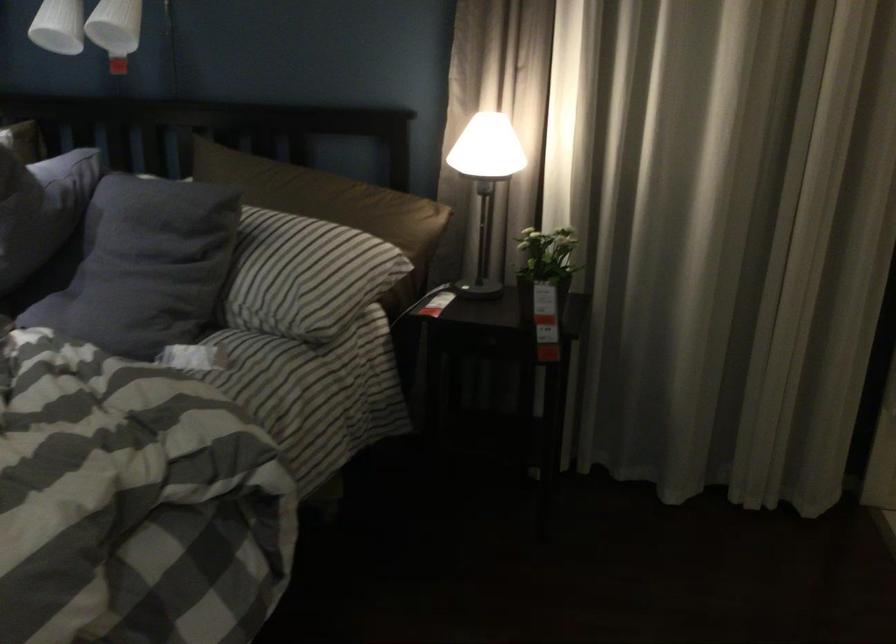
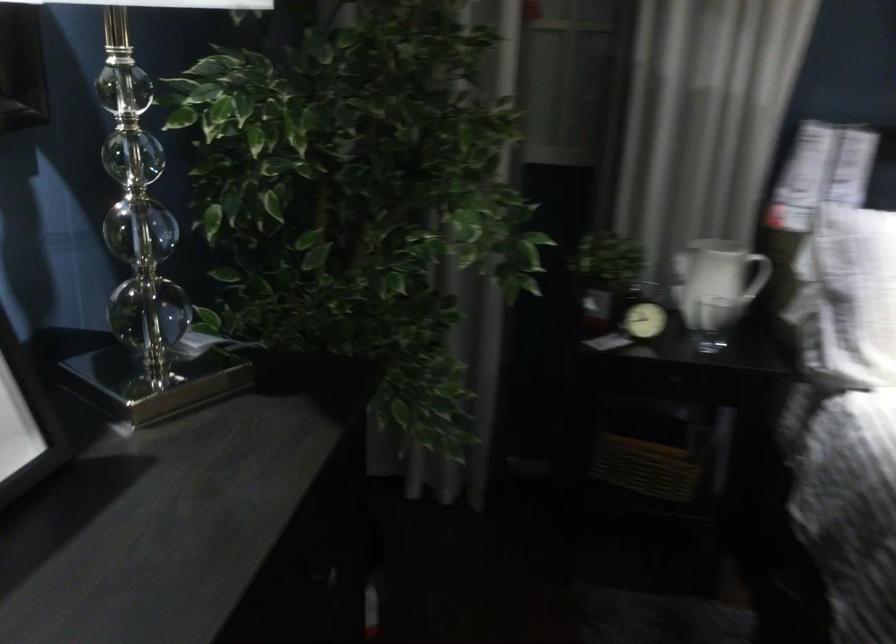
Question: In a continuous first-person perspective shot, in which direction is the camera moving?

Choices:
 (A) Left
 (B) Right
 (C) Forward
 (D) Backward

Answer: (A)